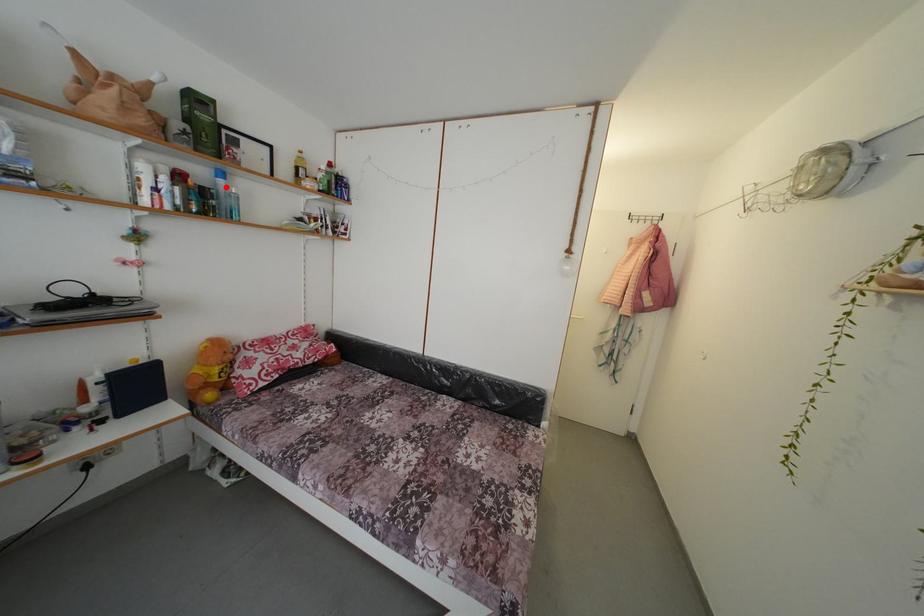
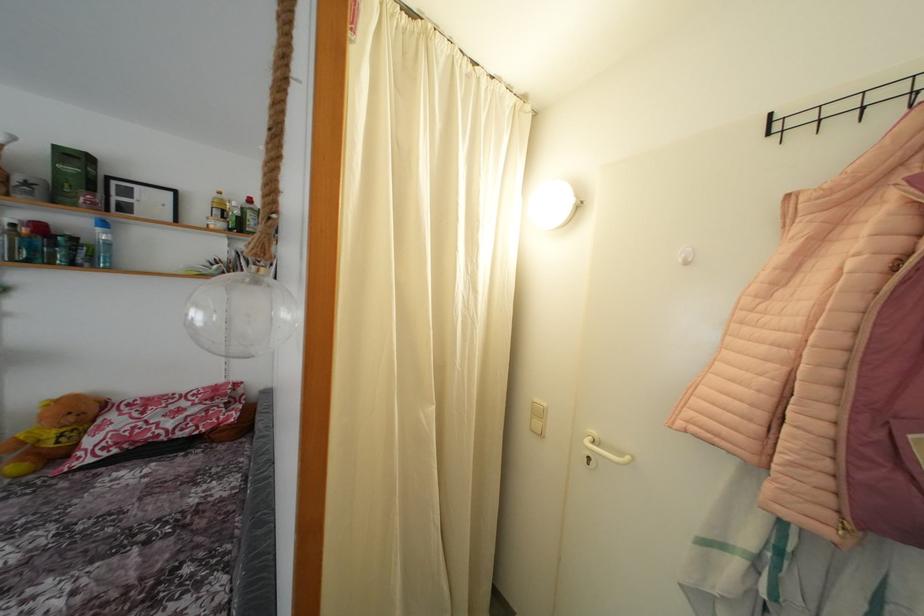
Find the pixel in the second image that matches the highlighted location in the first image.

(104, 236)